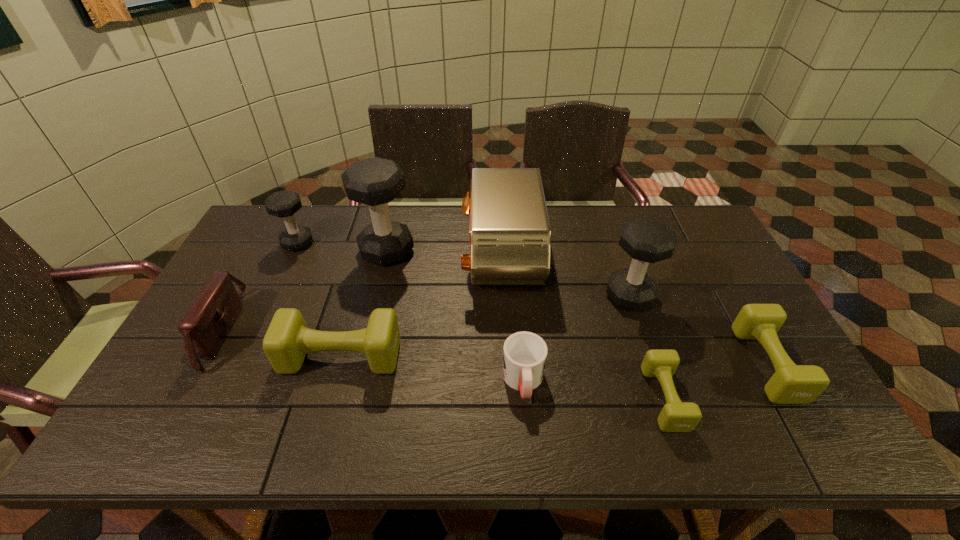
I want to click on the tallest dumbbell, so click(x=375, y=181).

At what (x,y) coordinates should I click in order to perform the action: click on the tallest object. Please return your answer as a coordinate pair (x, y). This screenshot has height=540, width=960. Looking at the image, I should click on (375, 181).

In order to click on the second biggest gray dumbbell in this screenshot , I will do `click(647, 241)`.

Locate an element on the screen. The image size is (960, 540). the rightmost gray dumbbell is located at coordinates pyautogui.click(x=647, y=241).

In order to click on toaster oven in this screenshot , I will do `click(510, 235)`.

Find the location of a particular element. This screenshot has height=540, width=960. the sixth shortest object is located at coordinates (283, 204).

I want to click on the leftmost dumbbell, so click(283, 204).

You are a GUI agent. You are given a task and a screenshot of the screen. Output one action in this format:
    pyautogui.click(x=<x>, y=<y>)
    Task: Click on the shoulder bag
    This screenshot has width=960, height=540.
    Given the screenshot: What is the action you would take?
    pyautogui.click(x=204, y=327)

Locate an element on the screen. The image size is (960, 540). the leftmost olive dumbbell is located at coordinates (287, 341).

This screenshot has height=540, width=960. Find the location of `the biggest olive dumbbell`. the biggest olive dumbbell is located at coordinates point(287,341).